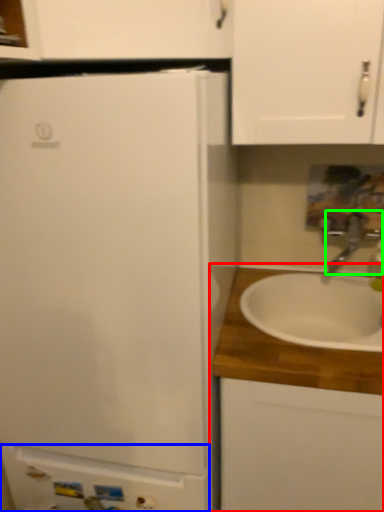
Question: Which object is positioned closest to cabinetry (highlighted by a red box)? Select from cabinetry (highlighted by a blue box) and tap (highlighted by a green box).

Choices:
 (A) cabinetry
 (B) tap

Answer: (A)